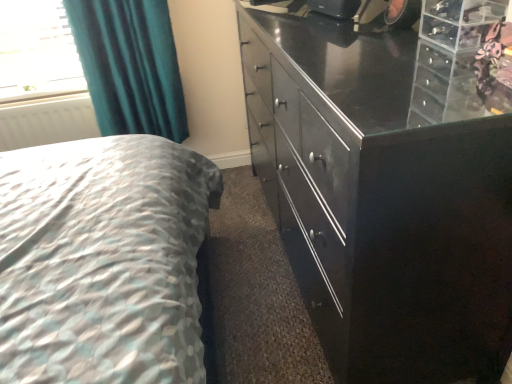
Question: From a real-world perspective, is glossy black cabinet at right on teal fabric curtain at upper left?

Choices:
 (A) yes
 (B) no

Answer: (B)

Question: From a real-world perspective, is glossy black cabinet at right beneath teal fabric curtain at upper left?

Choices:
 (A) no
 (B) yes

Answer: (B)

Question: From the image's perspective, would you say glossy black cabinet at right is positioned over teal fabric curtain at upper left?

Choices:
 (A) no
 (B) yes

Answer: (A)

Question: Does glossy black cabinet at right lie behind teal fabric curtain at upper left?

Choices:
 (A) yes
 (B) no

Answer: (B)

Question: Is glossy black cabinet at right thinner than teal fabric curtain at upper left?

Choices:
 (A) no
 (B) yes

Answer: (A)

Question: From their relative heights in the image, would you say white matte radiator at left is taller or shorter than glossy black cabinet at right?

Choices:
 (A) tall
 (B) short

Answer: (B)

Question: From the image's perspective, is white matte radiator at left above or below glossy black cabinet at right?

Choices:
 (A) below
 (B) above

Answer: (B)

Question: Looking at the image, does white matte radiator at left seem bigger or smaller compared to glossy black cabinet at right?

Choices:
 (A) small
 (B) big

Answer: (A)

Question: Does point (13, 145) appear closer or farther from the camera than point (370, 225)?

Choices:
 (A) farther
 (B) closer

Answer: (A)

Question: Looking at their shapes, would you say teal fabric curtain at upper left is wider or thinner than white matte radiator at left?

Choices:
 (A) thin
 (B) wide

Answer: (B)

Question: From the image's perspective, is teal fabric curtain at upper left located above or below white matte radiator at left?

Choices:
 (A) above
 (B) below

Answer: (A)

Question: Considering their positions, is teal fabric curtain at upper left located in front of or behind white matte radiator at left?

Choices:
 (A) front
 (B) behind

Answer: (A)

Question: From a real-world perspective, is teal fabric curtain at upper left above or below white matte radiator at left?

Choices:
 (A) below
 (B) above

Answer: (B)

Question: In the image, is teal fabric curtain at upper left on the left side or the right side of glossy black cabinet at right?

Choices:
 (A) left
 (B) right

Answer: (A)

Question: Is teal fabric curtain at upper left situated inside glossy black cabinet at right or outside?

Choices:
 (A) inside
 (B) outside

Answer: (B)